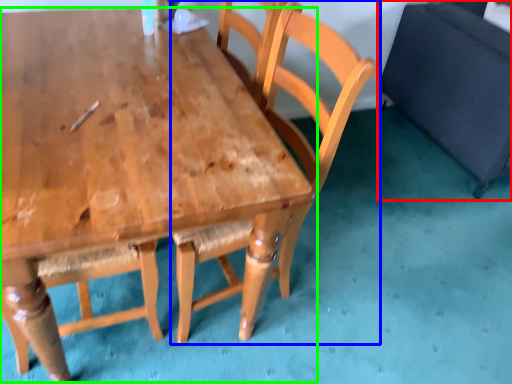
Question: Which is farther away from swivel chair (highlighted by a red box)? chair (highlighted by a blue box) or table (highlighted by a green box)?

Choices:
 (A) chair
 (B) table

Answer: (B)